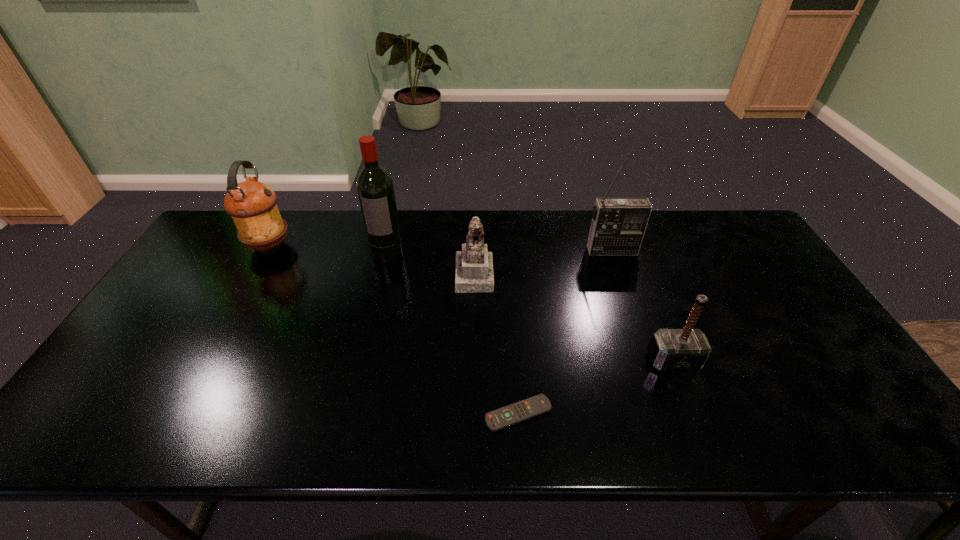
Identify the location of the second object from left to right. Image resolution: width=960 pixels, height=540 pixels. (375, 188).

You are a GUI agent. You are given a task and a screenshot of the screen. Output one action in this format:
    pyautogui.click(x=<x>, y=<y>)
    Task: Click on the radio receiver
    
    Given the screenshot: What is the action you would take?
    pyautogui.click(x=618, y=226)

This screenshot has width=960, height=540. I want to click on the leftmost object, so click(252, 205).

You are a GUI agent. You are given a task and a screenshot of the screen. Output one action in this format:
    pyautogui.click(x=<x>, y=<y>)
    Task: Click on the fourth shortest object
    This screenshot has width=960, height=540.
    Given the screenshot: What is the action you would take?
    pyautogui.click(x=252, y=205)

Locate an element on the screen. This screenshot has height=540, width=960. the second nearest object is located at coordinates (688, 349).

Where is `figurine`? Image resolution: width=960 pixels, height=540 pixels. figurine is located at coordinates (473, 264).

Identify the location of the nearest object. (501, 418).

Find the location of a particular element. The image size is (960, 540). the shortest object is located at coordinates (501, 418).

You are a GUI agent. You are given a task and a screenshot of the screen. Output one action in this format:
    pyautogui.click(x=<x>, y=<y>)
    Task: Click on the vacant space located 0.210m on the label of the wine bottle
    Image resolution: width=960 pixels, height=540 pixels.
    Given the screenshot: What is the action you would take?
    pyautogui.click(x=372, y=312)

Where is `vacant region located 0.150m on the display of the radio receiver`? Image resolution: width=960 pixels, height=540 pixels. vacant region located 0.150m on the display of the radio receiver is located at coordinates point(626,289).